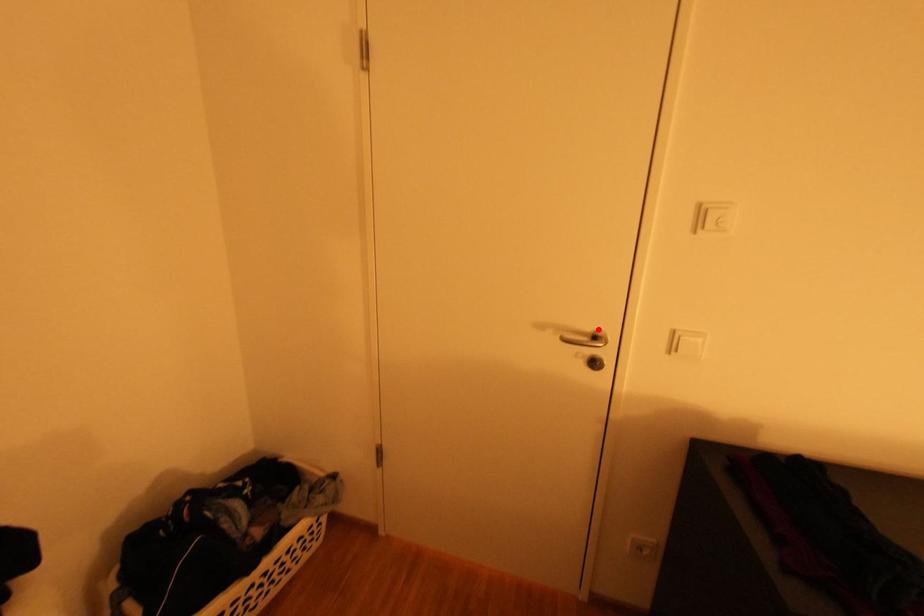
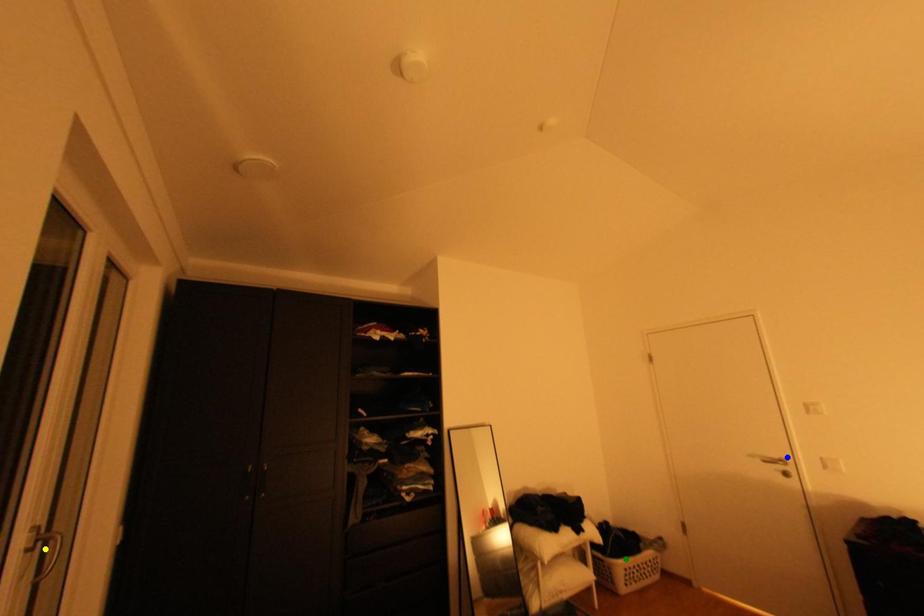
Question: I am providing you with two images of the same scene from different viewpoints. A red point is marked on the first image. You are given multiple points on the second image. Which spot in image 2 lines up with the point in image 1?

Choices:
 (A) yellow point
 (B) blue point
 (C) green point

Answer: (B)